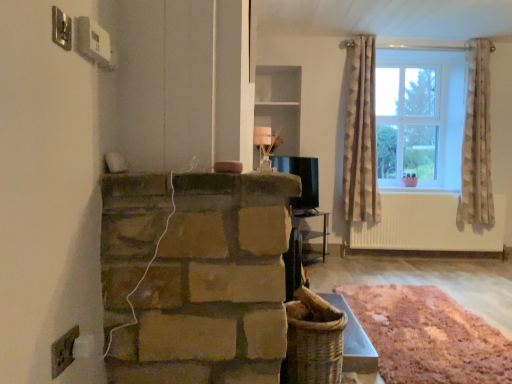
I want to click on empty space that is ontop of beige textured curtain at upper right (from a real-world perspective), so click(x=367, y=35).